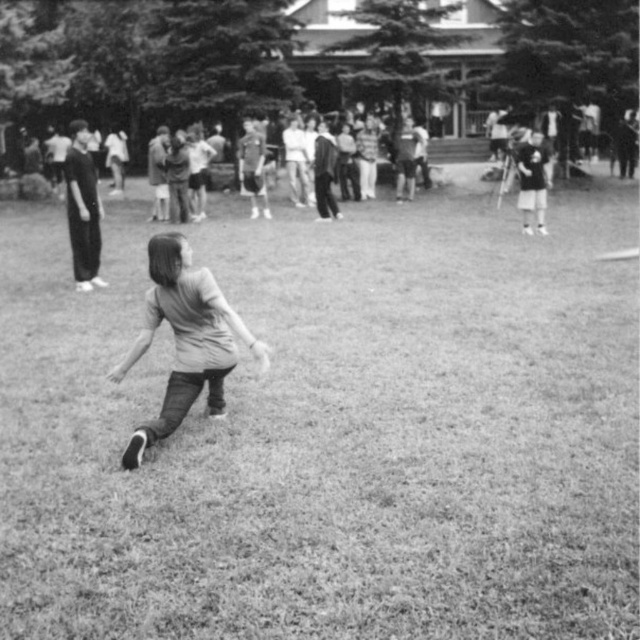
You are organizing a charity event and need to decide which outfit to choose for a quick costume change. You have the dark gray pants at left and the dark gray suit at center. Which one would be more suitable if you need to move quickly?

The dark gray pants at left are larger in size than the dark gray suit at center, making them more suitable for quick movements as they allow for greater ease of motion.

In the black and white photo, where is the dark gray pants at left located in terms of coordinates?

The dark gray pants at left is located at coordinates point (83, 209).

Looking at this image, you are a photographer analyzing the image. You notice the dark gray pants at left and the smooth leather jacket at upper center. Which object takes up more area in the photo?

The smooth leather jacket at upper center takes up more area in the photo than the dark gray pants at left because the dark gray pants at left occupies less space than smooth leather jacket at upper center.